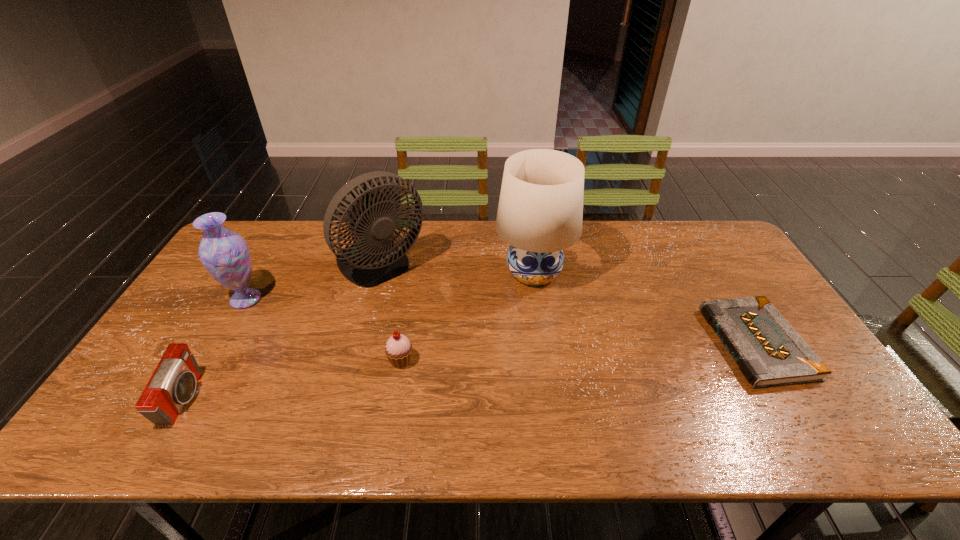
Find the location of `free space between the camera and the cupcake`. free space between the camera and the cupcake is located at coordinates (292, 380).

The image size is (960, 540). Identify the location of unoccupied area between the camera and the fifth object from left to right. (359, 336).

The width and height of the screenshot is (960, 540). Identify the location of free space between the rightmost object and the cupcake. (578, 352).

Find the location of a particular element. vacant point located between the fifth object from left to right and the fan is located at coordinates (457, 270).

Find the location of a particular element. The width and height of the screenshot is (960, 540). free space between the rightmost object and the vase is located at coordinates (501, 321).

At what (x,y) coordinates should I click in order to perform the action: click on unoccupied area between the cupcake and the notebook. Please return your answer as a coordinate pair (x, y). Image resolution: width=960 pixels, height=540 pixels. Looking at the image, I should click on (578, 352).

Locate which object is the fourth closest to the cupcake. Please provide its 2D coordinates. Your answer should be formatted as a tuple, i.e. [(x, y)], where the tuple contains the x and y coordinates of a point satisfying the conditions above.

[(173, 384)]

Find the location of a particular element. The image size is (960, 540). object identified as the second closest to the vase is located at coordinates (173, 384).

Locate an element on the screen. Image resolution: width=960 pixels, height=540 pixels. vacant space that satisfies the following two spatial constraints: 1. on the front-facing side of the lampshade; 2. on the front-facing side of the camera is located at coordinates (551, 399).

The image size is (960, 540). Identify the location of free spot that satisfies the following two spatial constraints: 1. in front of the cupcake to direct airflow; 2. on the left side of the fan. [355, 361].